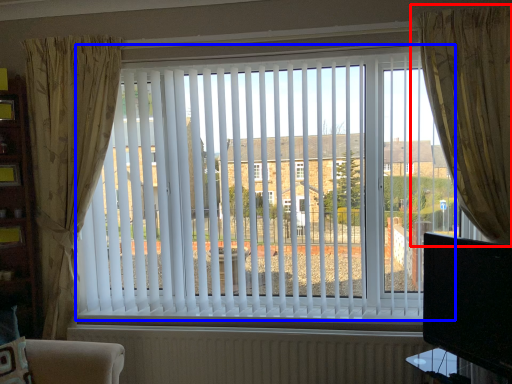
Question: Which point is further to the camera, curtain (highlighted by a red box) or window blind (highlighted by a blue box)?

Choices:
 (A) curtain
 (B) window blind

Answer: (B)